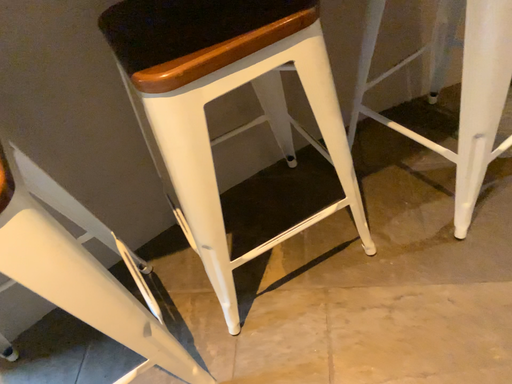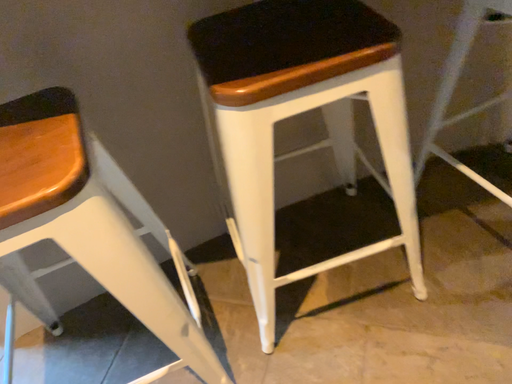
Question: How did the camera likely rotate when shooting the video?

Choices:
 (A) rotated left
 (B) rotated right

Answer: (A)